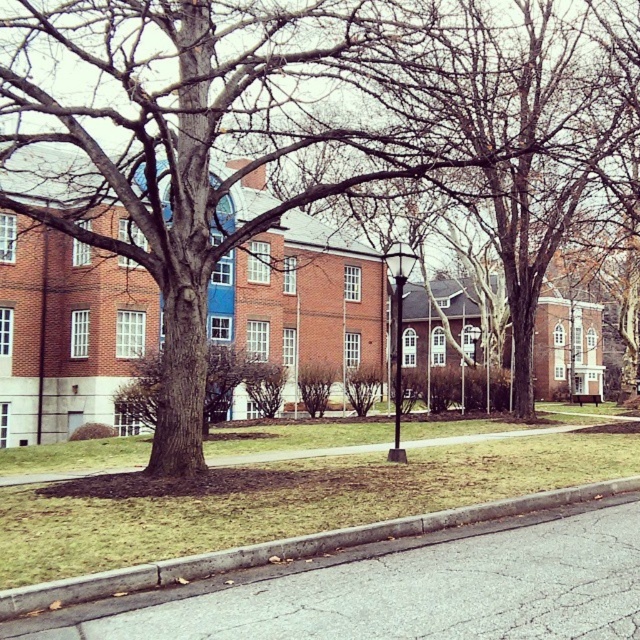
You are standing at the point labeled point [214,132] on the brown rough bark tree at center. What is the nearest object to you in the scene?

The nearest object to you is the brown rough bark tree at center, as you are standing on it.

Consider the image. You are standing at the point labeled point (214, 132) in the image. What object are you directly facing?

You are directly facing the brown rough bark tree at center, as the point (214, 132) corresponds to that object.

You are a pedestrian approaching the gray concrete curb at lower center. There is a brown rough bark tree at center in your path. Which object will you encounter first?

You will encounter the brown rough bark tree at center first because it is closer to you than the gray concrete curb at lower center.